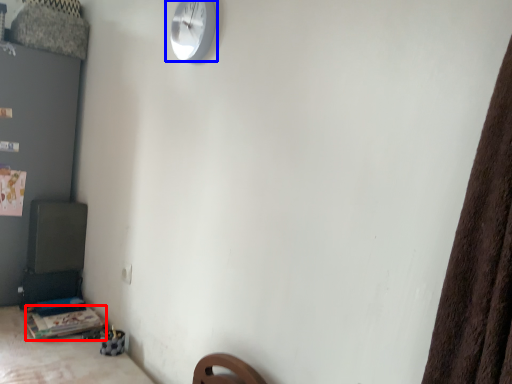
Question: Which object appears farthest to the camera in this image, table (highlighted by a red box) or wall clock (highlighted by a blue box)?

Choices:
 (A) table
 (B) wall clock

Answer: (A)